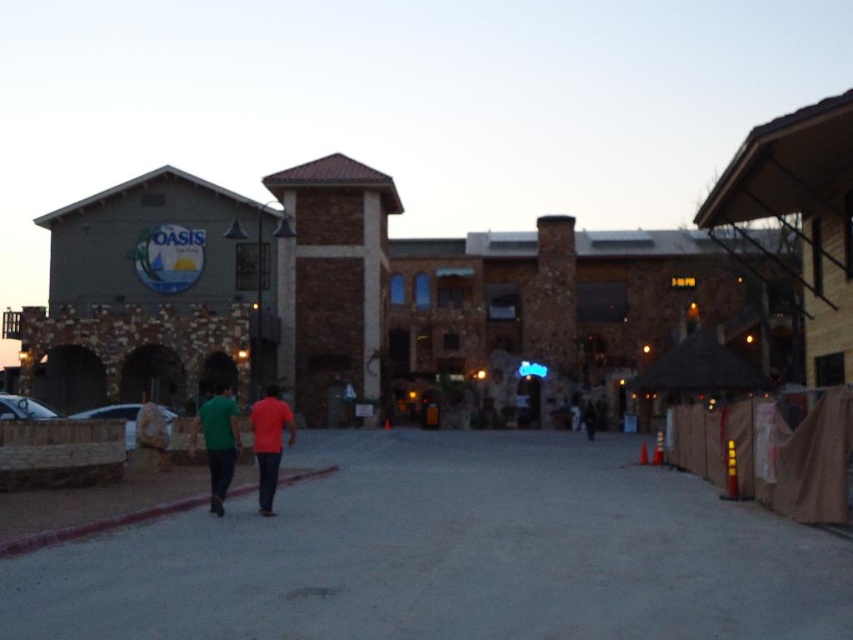
Question: Does green fabric shirt at center appear under matte red shirt at center?

Choices:
 (A) yes
 (B) no

Answer: (B)

Question: Is green matte shirt at center bigger than matte red shirt at center?

Choices:
 (A) yes
 (B) no

Answer: (A)

Question: Estimate the real-world distances between objects in this image. Which object is closer to the green matte shirt at center?

Choices:
 (A) gray asphalt pavement at center
 (B) dark blue jeans at center

Answer: (A)

Question: Which point appears farthest from the camera in this image?

Choices:
 (A) (210, 440)
 (B) (223, 513)

Answer: (B)

Question: Can you confirm if green fabric shirt at center is positioned below matte red shirt at center?

Choices:
 (A) yes
 (B) no

Answer: (B)

Question: Which of the following is the closest to the observer?

Choices:
 (A) gray asphalt pavement at center
 (B) green fabric shirt at center
 (C) matte red shirt at center
 (D) dark blue jeans at center

Answer: (A)